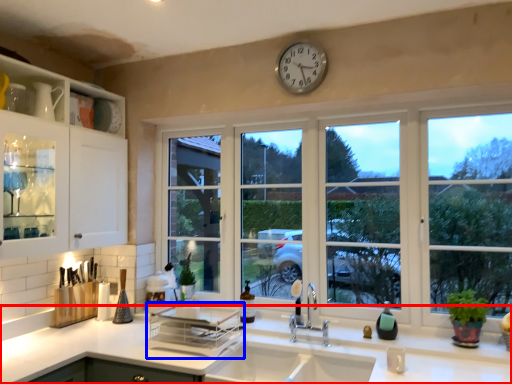
Question: Which object is further to the camera taking this photo, countertop (highlighted by a red box) or appliance (highlighted by a blue box)?

Choices:
 (A) countertop
 (B) appliance

Answer: (B)